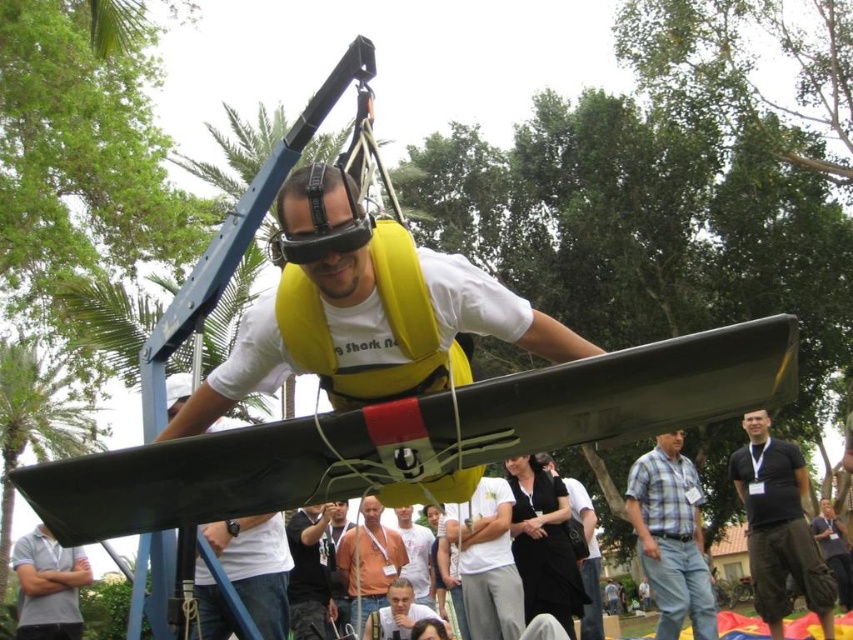
Question: Can you confirm if black cotton shirt at lower right is thinner than dark blue jeans at center?

Choices:
 (A) no
 (B) yes

Answer: (A)

Question: Which point is closer to the camera taking this photo?

Choices:
 (A) (426, 609)
 (B) (291, 522)

Answer: (B)

Question: Which of the following is the closest to the observer?

Choices:
 (A) white matte shirt at center
 (B) brown fabric shirt at center
 (C) plaid cotton shirt at center
 (D) light brown leather jacket at lower center

Answer: (C)

Question: Considering the relative positions of black cotton shirt at lower right and white shirt at center in the image provided, where is black cotton shirt at lower right located with respect to white shirt at center?

Choices:
 (A) below
 (B) above

Answer: (B)

Question: Considering the relative positions of brown fabric shirt at center and white shirt at center in the image provided, where is brown fabric shirt at center located with respect to white shirt at center?

Choices:
 (A) below
 (B) above

Answer: (B)

Question: Estimate the real-world distances between objects in this image. Which object is farther from the brown fabric shirt at center?

Choices:
 (A) white shirt at center
 (B) light brown leather jacket at lower center

Answer: (A)